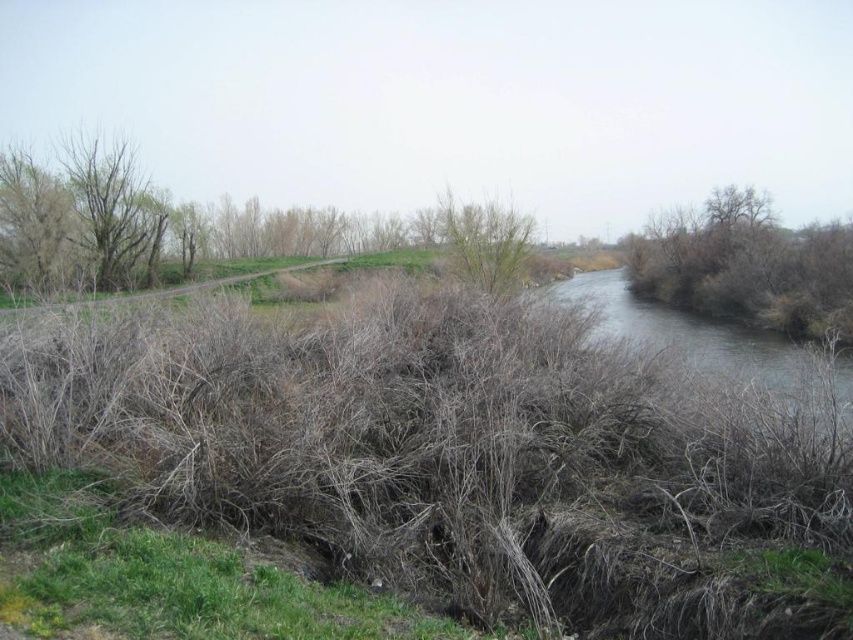
Which is behind, point (666, 221) or point (111, 214)?

The point (666, 221) is behind.

Who is more forward, (751, 205) or (142, 186)?

Point (142, 186) is more forward.

Where is `brown dry shrub at right`? The image size is (853, 640). brown dry shrub at right is located at coordinates (747, 268).

Where is `brown dry shrub at right`? Image resolution: width=853 pixels, height=640 pixels. brown dry shrub at right is located at coordinates (747, 268).